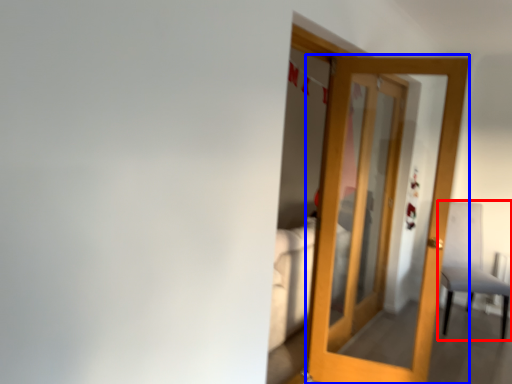
Question: Which object is closer to the camera taking this photo, chair (highlighted by a red box) or door (highlighted by a blue box)?

Choices:
 (A) chair
 (B) door

Answer: (B)